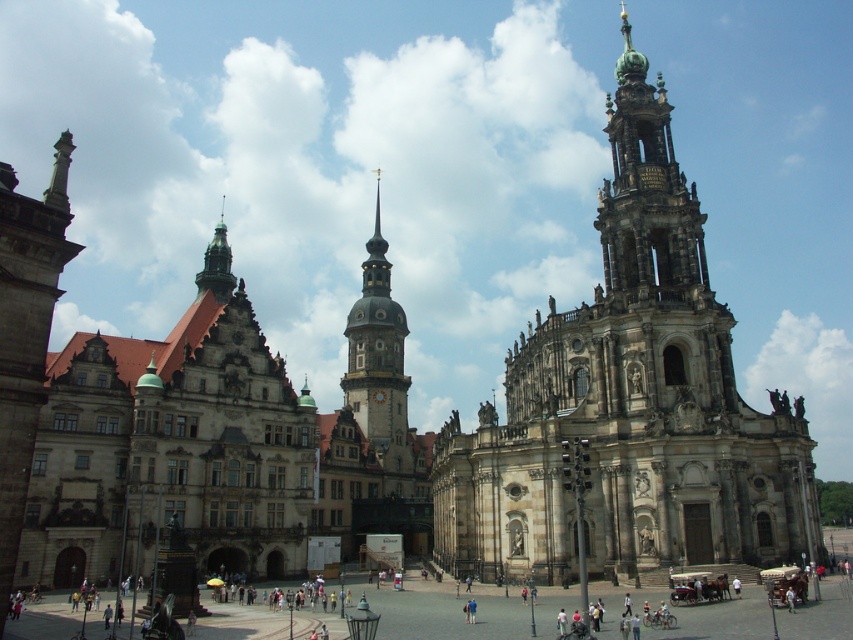
Who is positioned more to the right, stone paved square at center or stone spire at center?

stone paved square at center

Does stone paved square at center come behind stone spire at center?

A: That is False.

Is point (7, 636) positioned before point (408, 442)?

Yes, point (7, 636) is in front of point (408, 442).

At what (x,y) coordinates should I click in order to perform the action: click on stone paved square at center. Please return your answer as a coordinate pair (x, y). Looking at the image, I should click on (444, 612).

Who is higher up, stone paved square at center or stone column at left?

stone column at left is higher up.

How far apart are stone paved square at center and stone column at left?

stone paved square at center is 103.28 feet away from stone column at left.

The image size is (853, 640). What are the coordinates of `stone paved square at center` in the screenshot? It's located at (444, 612).

Is point (606, 310) positioned after point (57, 189)?

Yes, it is.

Is stone tower at center shorter than stone column at left?

No, stone tower at center is not shorter than stone column at left.

Is point (544, 486) behind point (15, 461)?

Yes, point (544, 486) is farther from viewer.

At what (x,y) coordinates should I click in order to perform the action: click on stone tower at center. Please return your answer as a coordinate pair (x, y). The image size is (853, 640). Looking at the image, I should click on (628, 404).